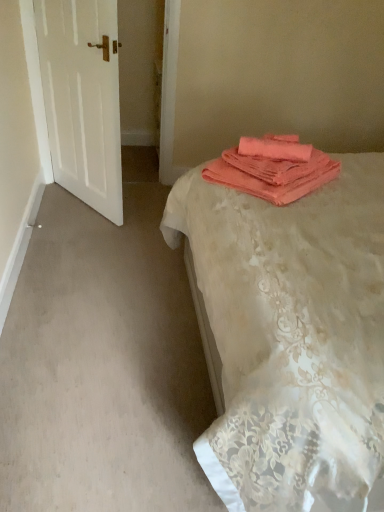
This screenshot has height=512, width=384. What are the coordinates of `white matte door at left` in the screenshot? It's located at (82, 98).

Which of these two, coral fabric bed at center or white matte door at left, is wider?

Wider between the two is coral fabric bed at center.

From a real-world perspective, which object stands above the other?

coral fabric bed at center is physically above.

Is coral fabric bed at center touching white matte door at left?

No, coral fabric bed at center is not next to white matte door at left.

Find the location of a particular element. The width and height of the screenshot is (384, 512). bed above the white matte door at left (from a real-world perspective) is located at coordinates (292, 336).

From a real-world perspective, which object rests below the other?

white matte door at left is physically lower.

Which of these two, white matte door at left or coral fabric towels at upper right, stands shorter?

coral fabric towels at upper right.

Can you confirm if white matte door at left is smaller than coral fabric towels at upper right?

No, white matte door at left is not smaller than coral fabric towels at upper right.

Is coral fabric towels at upper right facing towards white matte door at left?

Yes, coral fabric towels at upper right is turned towards white matte door at left.

Does coral fabric towels at upper right have a greater height compared to white matte door at left?

No, coral fabric towels at upper right is not taller than white matte door at left.

Is point (288, 139) positioned in front of point (111, 83)?

Yes, it is.

Does coral fabric towels at upper right come in front of white matte door at left?

Yes, coral fabric towels at upper right is closer to the camera.

Does coral fabric bed at center lie in front of coral fabric towels at upper right?

Yes.

Considering the positions of objects coral fabric bed at center and coral fabric towels at upper right in the image provided, who is more to the left, coral fabric bed at center or coral fabric towels at upper right?

coral fabric towels at upper right is more to the left.

Which object is thinner, coral fabric bed at center or coral fabric towels at upper right?

coral fabric towels at upper right is thinner.

Considering the sizes of objects coral fabric bed at center and coral fabric towels at upper right in the image provided, who is smaller, coral fabric bed at center or coral fabric towels at upper right?

Smaller between the two is coral fabric towels at upper right.

Considering the sizes of white matte door at left and coral fabric bed at center in the image, is white matte door at left wider or thinner than coral fabric bed at center?

Considering their sizes, white matte door at left looks slimmer than coral fabric bed at center.

Is white matte door at left bigger than coral fabric bed at center?

No, white matte door at left is not bigger than coral fabric bed at center.

From the image's perspective, is white matte door at left below coral fabric bed at center?

Actually, white matte door at left appears above coral fabric bed at center in the image.

Is point (122, 205) closer or farther from the camera than point (380, 321)?

Point (122, 205) is positioned farther from the camera compared to point (380, 321).

Is coral fabric towels at upper right aimed at coral fabric bed at center?

Yes, coral fabric towels at upper right faces towards coral fabric bed at center.

Consider the image. Which of these two, coral fabric towels at upper right or coral fabric bed at center, stands taller?

coral fabric bed at center.

From the image's perspective, is coral fabric towels at upper right beneath coral fabric bed at center?

No, from the image's perspective, coral fabric towels at upper right is not beneath coral fabric bed at center.

You are a GUI agent. You are given a task and a screenshot of the screen. Output one action in this format:
    pyautogui.click(x=<x>, y=<y>)
    Task: Click on the door behind the coral fabric bed at center
    This screenshot has width=384, height=512.
    Given the screenshot: What is the action you would take?
    pyautogui.click(x=82, y=98)

At what (x,y) coordinates should I click in order to perform the action: click on door above the coral fabric towels at upper right (from the image's perspective). Please return your answer as a coordinate pair (x, y). This screenshot has height=512, width=384. Looking at the image, I should click on (82, 98).

When comparing their distances from white matte door at left, does coral fabric bed at center or coral fabric towels at upper right seem closer?

Based on the image, coral fabric towels at upper right appears to be nearer to white matte door at left.

Considering their positions, is coral fabric towels at upper right positioned further to white matte door at left than coral fabric bed at center?

coral fabric bed at center is further to white matte door at left.

Based on their spatial positions, is white matte door at left or coral fabric towels at upper right further from coral fabric bed at center?

The object further to coral fabric bed at center is white matte door at left.

Estimate the real-world distances between objects in this image. Which object is closer to coral fabric bed at center, coral fabric towels at upper right or white matte door at left?

Among the two, coral fabric towels at upper right is located nearer to coral fabric bed at center.

Estimate the real-world distances between objects in this image. Which object is further from coral fabric towels at upper right, white matte door at left or coral fabric bed at center?

white matte door at left lies further to coral fabric towels at upper right than the other object.

Estimate the real-world distances between objects in this image. Which object is closer to coral fabric towels at upper right, coral fabric bed at center or white matte door at left?

coral fabric bed at center.

Find the location of a particular element. Image resolution: width=384 pixels, height=512 pixels. towel positioned between coral fabric bed at center and white matte door at left from near to far is located at coordinates (273, 168).